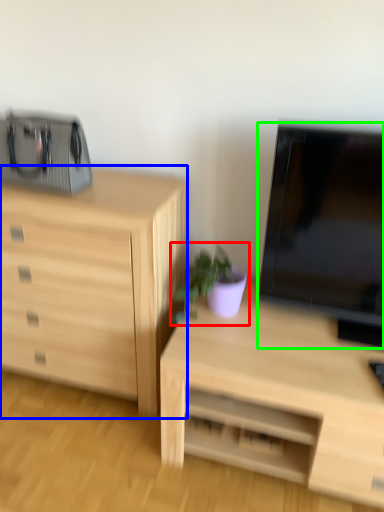
Question: Which object is positioned closest to houseplant (highlighted by a red box)? Select from chest of drawers (highlighted by a blue box) and television (highlighted by a green box).

Choices:
 (A) chest of drawers
 (B) television

Answer: (B)